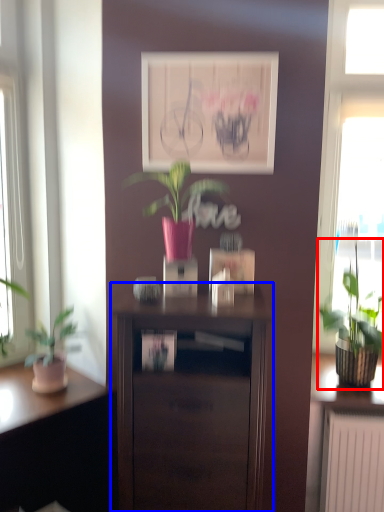
Question: Which object appears closest to the camera in this image, houseplant (highlighted by a red box) or nightstand (highlighted by a blue box)?

Choices:
 (A) houseplant
 (B) nightstand

Answer: (B)